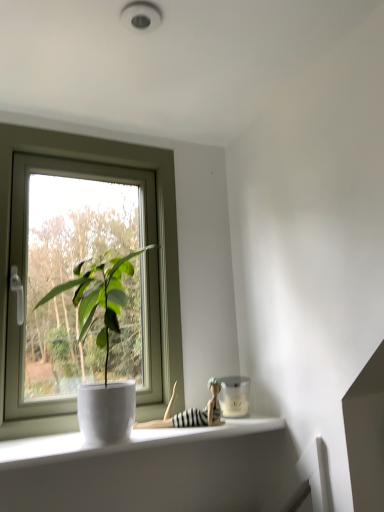
What are the coordinates of `free space above white glossy window sill at lower left (from a real-world perspective)` in the screenshot? It's located at (144, 430).